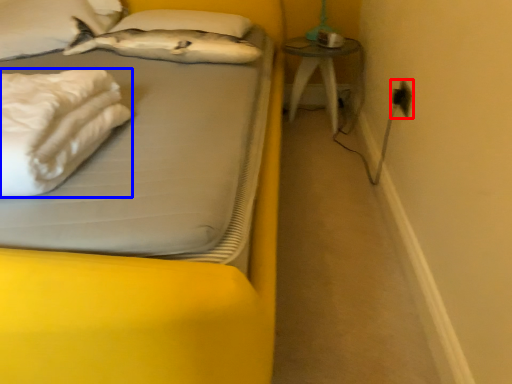
Question: Which of the following is the closest to the observer, electric outlet (highlighted by a red box) or material (highlighted by a blue box)?

Choices:
 (A) electric outlet
 (B) material

Answer: (B)